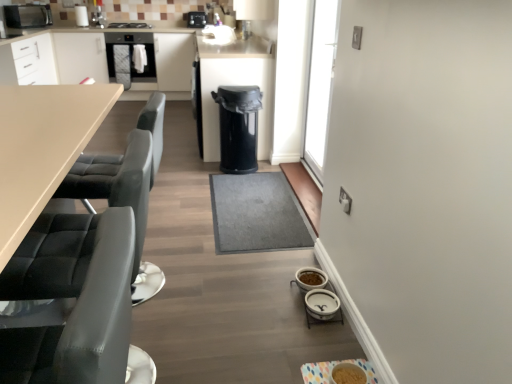
Question: Can you confirm if white ceramic bowls at lower right, acting as the 3th appliance starting from the right, is smaller than black plastic camera at upper center, which ranks as the seventh appliance in front-to-back order?

Choices:
 (A) yes
 (B) no

Answer: (A)

Question: Is white ceramic bowls at lower right, the 6th appliance in the top-to-bottom sequence, thinner than black plastic camera at upper center, the 1th appliance in the back-to-front sequence?

Choices:
 (A) no
 (B) yes

Answer: (B)

Question: Does white ceramic bowls at lower right, the 6th appliance in the top-to-bottom sequence, have a larger size compared to black plastic camera at upper center, the first appliance when ordered from top to bottom?

Choices:
 (A) yes
 (B) no

Answer: (B)

Question: Is the position of white ceramic bowls at lower right, the 6th appliance in the top-to-bottom sequence, less distant than that of black plastic camera at upper center, marked as the 2th appliance in a left-to-right arrangement?

Choices:
 (A) no
 (B) yes

Answer: (B)

Question: Can you confirm if white ceramic bowls at lower right, the 5th appliance when ordered from left to right, is taller than black plastic camera at upper center, the first appliance when ordered from top to bottom?

Choices:
 (A) yes
 (B) no

Answer: (B)

Question: Is matte black oven at upper left wider or thinner than black matte microwave at upper left, which is the sixth appliance from front to back?

Choices:
 (A) thin
 (B) wide

Answer: (B)

Question: From their relative heights in the image, would you say matte black oven at upper left is taller or shorter than black matte microwave at upper left, which is the 2th appliance in back-to-front order?

Choices:
 (A) short
 (B) tall

Answer: (B)

Question: Considering the positions of matte black oven at upper left and black matte microwave at upper left, which is the sixth appliance from front to back, in the image, is matte black oven at upper left bigger or smaller than black matte microwave at upper left, which is the sixth appliance from front to back,?

Choices:
 (A) small
 (B) big

Answer: (B)

Question: Is point (126, 51) closer or farther from the camera than point (42, 9)?

Choices:
 (A) closer
 (B) farther

Answer: (B)

Question: From the image's perspective, is black matte stove at upper center positioned above or below white ceramic bowls at lower right, the 6th appliance in the top-to-bottom sequence?

Choices:
 (A) above
 (B) below

Answer: (A)

Question: Considering the relative positions of black matte stove at upper center and white ceramic bowls at lower right, which appears as the 2th appliance when viewed from the front, in the image provided, is black matte stove at upper center to the left or to the right of white ceramic bowls at lower right, which appears as the 2th appliance when viewed from the front,?

Choices:
 (A) left
 (B) right

Answer: (A)

Question: From a real-world perspective, is black matte stove at upper center physically located above or below white ceramic bowls at lower right, acting as the 3th appliance starting from the right?

Choices:
 (A) below
 (B) above

Answer: (B)

Question: In the image, is black matte stove at upper center positioned in front of or behind white ceramic bowls at lower right, positioned as the 6th appliance in back-to-front order?

Choices:
 (A) front
 (B) behind

Answer: (B)

Question: From the image's perspective, relative to white ceramic bowls at lower center, which is counted as the 6th appliance, starting from the left, is black matte stove at upper center above or below?

Choices:
 (A) below
 (B) above

Answer: (B)

Question: Is point [123, 24] positioned closer to the camera than point [325, 289]?

Choices:
 (A) closer
 (B) farther

Answer: (B)